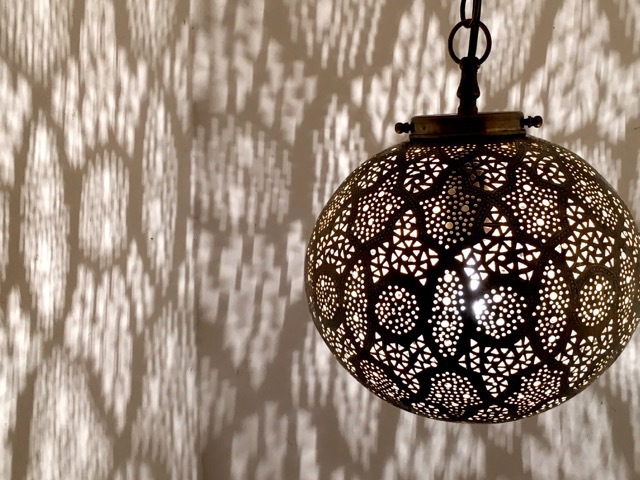
Where is `light bulb`? This screenshot has width=640, height=480. light bulb is located at coordinates (477, 310).